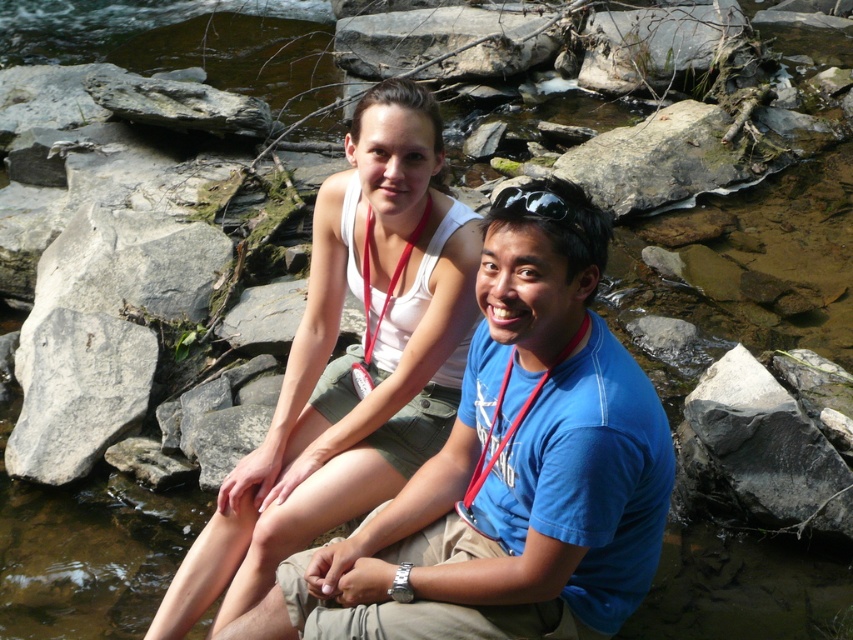
You are standing at the origin point in the image, which is the bottom left corner. You want to pick up the black smooth rock at lower right. What are the coordinates of the rock?

The coordinates of the black smooth rock at lower right are at point [763,449].

From the picture: You are standing at the point labeled as point (763, 449) in the image. What object are you standing on?

You are standing on the black smooth rock at lower right indicated by point (763, 449).